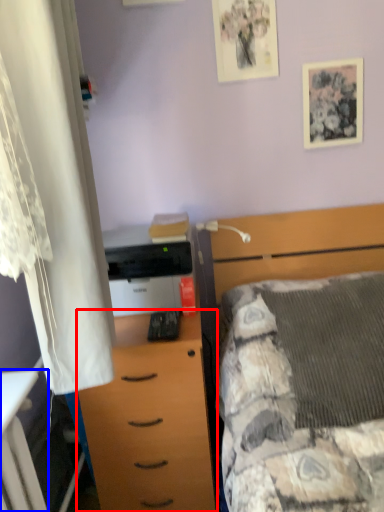
Question: Which of the following is the closest to the observer, chest of drawers (highlighted by a red box) or desk (highlighted by a blue box)?

Choices:
 (A) chest of drawers
 (B) desk

Answer: (B)